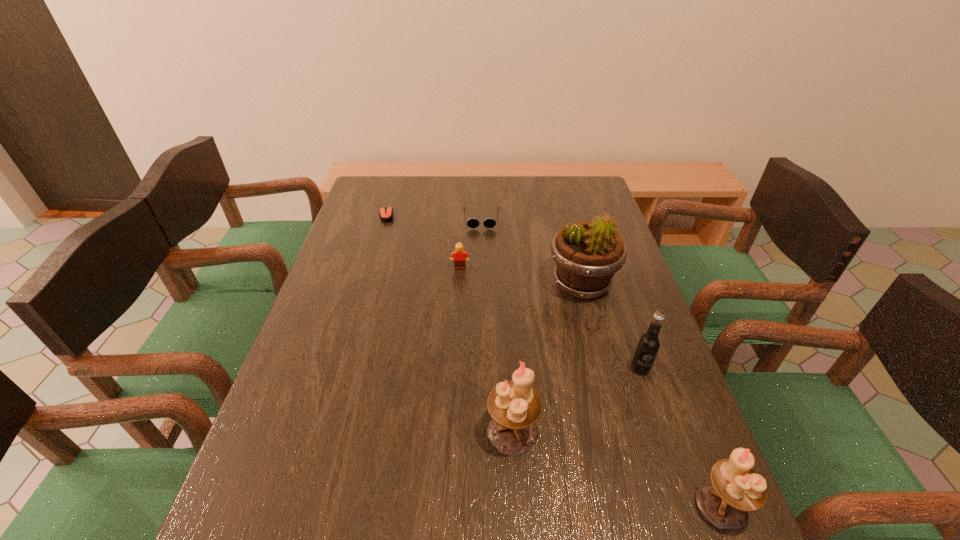
Where is `vacant space located 0.150m on the right of the farther candle holder`? vacant space located 0.150m on the right of the farther candle holder is located at coordinates (611, 432).

At what (x,y) coordinates should I click in order to perform the action: click on vacant region located on the back of the nearer candle holder. Please return your answer as a coordinate pair (x, y). The image size is (960, 540). Looking at the image, I should click on (653, 332).

Where is `vacant position located 0.090m on the left of the leftmost object`? Image resolution: width=960 pixels, height=540 pixels. vacant position located 0.090m on the left of the leftmost object is located at coordinates (352, 215).

Find the location of `free space located on the front-facing side of the sixth tallest object`. free space located on the front-facing side of the sixth tallest object is located at coordinates (482, 313).

Where is `free space located 0.090m on the face of the fifth tallest object`? free space located 0.090m on the face of the fifth tallest object is located at coordinates (459, 291).

Locate an element on the screen. vacant space located 0.280m on the label of the root beer is located at coordinates (684, 502).

Identify the location of free spot located on the front of the tallest object. The width and height of the screenshot is (960, 540). (598, 347).

Locate an element on the screen. computer mouse at the far edge is located at coordinates (386, 213).

Locate an element on the screen. Image resolution: width=960 pixels, height=540 pixels. sunglasses positioned at the far edge is located at coordinates (472, 222).

Identify the location of object located in the near edge section of the desktop. This screenshot has width=960, height=540. (735, 488).